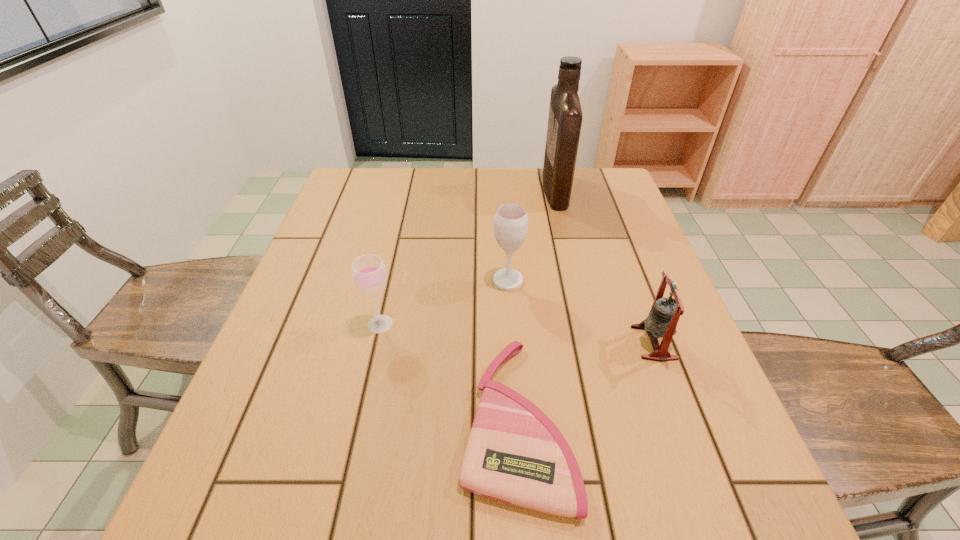
This screenshot has height=540, width=960. I want to click on the farthest object, so click(565, 117).

Where is `liquor`? liquor is located at coordinates [x=565, y=117].

The image size is (960, 540). I want to click on the right wineglass, so click(x=510, y=227).

Find the location of `the second farthest object`. the second farthest object is located at coordinates (510, 227).

Locate an element on the screen. This screenshot has height=540, width=960. the leftmost object is located at coordinates (369, 274).

The height and width of the screenshot is (540, 960). I want to click on the shorter wineglass, so click(369, 274).

Find the location of a particular element. Image resolution: width=960 pixels, height=540 pixels. the rightmost object is located at coordinates (664, 315).

The height and width of the screenshot is (540, 960). In order to click on wristlet in this screenshot , I will do `click(515, 454)`.

This screenshot has width=960, height=540. What are the coordinates of `free location located 0.240m on the label side of the liquor` in the screenshot? It's located at (467, 190).

Locate an element on the screen. free space located on the label side of the liquor is located at coordinates (441, 190).